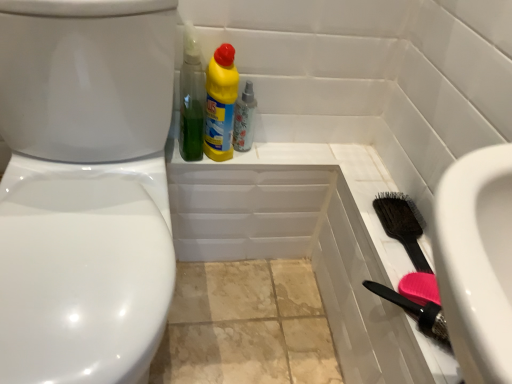
Question: Is the position of green plastic bottle at upper center, positioned as the 2th cleaning product in right-to-left order, more distant than that of white glossy bidet at left?

Choices:
 (A) yes
 (B) no

Answer: (A)

Question: Can you confirm if green plastic bottle at upper center, the 1th cleaning product viewed from the left, is bigger than white glossy bidet at left?

Choices:
 (A) yes
 (B) no

Answer: (B)

Question: Is green plastic bottle at upper center, positioned as the 2th cleaning product in right-to-left order, not within white glossy bidet at left?

Choices:
 (A) no
 (B) yes

Answer: (B)

Question: Does green plastic bottle at upper center, the 1th cleaning product viewed from the left, turn towards white glossy bidet at left?

Choices:
 (A) yes
 (B) no

Answer: (B)

Question: From the image's perspective, does green plastic bottle at upper center, positioned as the 2th cleaning product in right-to-left order, appear higher than white glossy bidet at left?

Choices:
 (A) yes
 (B) no

Answer: (A)

Question: Is green plastic bottle at upper center, the 1th cleaning product viewed from the left, directly adjacent to white glossy bidet at left?

Choices:
 (A) yes
 (B) no

Answer: (B)

Question: Is floral-patterned glass spray bottle at upper center directly adjacent to white glossy bidet at left?

Choices:
 (A) yes
 (B) no

Answer: (B)

Question: Is floral-patterned glass spray bottle at upper center to the right of white glossy bidet at left from the viewer's perspective?

Choices:
 (A) yes
 (B) no

Answer: (A)

Question: Is floral-patterned glass spray bottle at upper center outside white glossy bidet at left?

Choices:
 (A) no
 (B) yes

Answer: (B)

Question: Is floral-patterned glass spray bottle at upper center thinner than white glossy bidet at left?

Choices:
 (A) yes
 (B) no

Answer: (A)

Question: From the image's perspective, would you say floral-patterned glass spray bottle at upper center is shown under white glossy bidet at left?

Choices:
 (A) yes
 (B) no

Answer: (B)

Question: Does floral-patterned glass spray bottle at upper center have a larger size compared to white glossy bidet at left?

Choices:
 (A) yes
 (B) no

Answer: (B)

Question: Would you say green plastic bottle at upper center, positioned as the 2th cleaning product in right-to-left order, is part of floral-patterned glass spray bottle at upper center's contents?

Choices:
 (A) yes
 (B) no

Answer: (B)